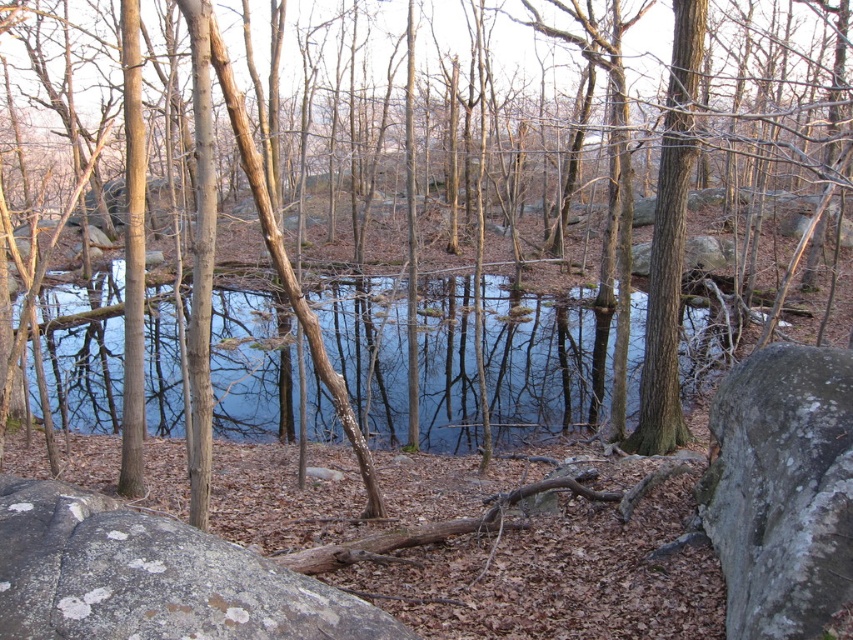
What do you see at coordinates (152, 577) in the screenshot? This screenshot has height=640, width=853. I see `speckled gray rock at center` at bounding box center [152, 577].

Where is `speckled gray rock at center`? Image resolution: width=853 pixels, height=640 pixels. speckled gray rock at center is located at coordinates (152, 577).

Who is taller, clear water at center or gray rough rock at lower right?

clear water at center is taller.

Between clear water at center and gray rough rock at lower right, which one appears on the right side from the viewer's perspective?

Positioned to the right is gray rough rock at lower right.

Who is more distant from viewer, [281,376] or [824,404]?

The point [281,376] is behind.

This screenshot has height=640, width=853. What are the coordinates of `clear water at center` in the screenshot? It's located at (543, 364).

Based on the photo, can you confirm if clear water at center is taller than speckled gray rock at center?

Correct, clear water at center is much taller as speckled gray rock at center.

Measure the distance between clear water at center and camera.

They are 12.05 meters apart.

Measure the distance between point (157, 416) and camera.

A distance of 14.36 meters exists between point (157, 416) and camera.

The image size is (853, 640). I want to click on clear water at center, so click(x=543, y=364).